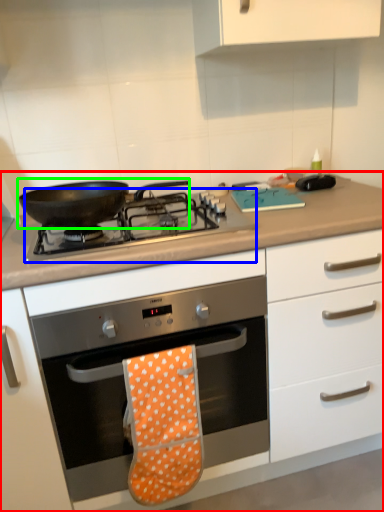
Question: Estimate the real-world distances between objects in this image. Which object is closer to cabinetry (highlighted by a red box), gas stove (highlighted by a blue box) or kitchen appliance (highlighted by a green box)?

Choices:
 (A) gas stove
 (B) kitchen appliance

Answer: (A)